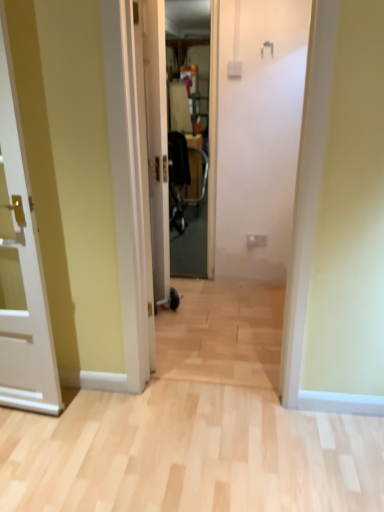
Question: Considering the relative sizes of transparent plastic screen door at center and white glossy door at left, the first door from the front, in the image provided, is transparent plastic screen door at center smaller than white glossy door at left, the first door from the front,?

Choices:
 (A) no
 (B) yes

Answer: (B)

Question: Is transparent plastic screen door at center facing away from white glossy door at left, which is the second door in right-to-left order?

Choices:
 (A) no
 (B) yes

Answer: (A)

Question: Is transparent plastic screen door at center bigger than white glossy door at left, the 1th door from the left?

Choices:
 (A) no
 (B) yes

Answer: (A)

Question: Is the depth of transparent plastic screen door at center less than that of white glossy door at left, which is the 2th door from back to front?

Choices:
 (A) yes
 (B) no

Answer: (B)

Question: Can you confirm if transparent plastic screen door at center is positioned to the left of white glossy door at left, the first door from the front?

Choices:
 (A) no
 (B) yes

Answer: (A)

Question: Is white glossy door at center, marked as the 1th door in a right-to-left arrangement, inside the boundaries of white glossy door at left, which is the 2th door from back to front, or outside?

Choices:
 (A) inside
 (B) outside

Answer: (B)

Question: From the image's perspective, is white glossy door at center, the 2th door when ordered from left to right, positioned above or below white glossy door at left, the first door from the front?

Choices:
 (A) above
 (B) below

Answer: (A)

Question: Based on their positions, is white glossy door at center, which is the second door from front to back, located to the left or right of white glossy door at left, which is the 2th door from back to front?

Choices:
 (A) right
 (B) left

Answer: (A)

Question: Considering the positions of white glossy door at center, the 2th door when ordered from left to right, and white glossy door at left, which is the second door in right-to-left order, in the image, is white glossy door at center, the 2th door when ordered from left to right, wider or thinner than white glossy door at left, which is the second door in right-to-left order,?

Choices:
 (A) wide
 (B) thin

Answer: (B)

Question: Is transparent plastic screen door at center wider or thinner than white glossy door at left, which is the 2th door from back to front?

Choices:
 (A) wide
 (B) thin

Answer: (A)

Question: In the image, is transparent plastic screen door at center positioned in front of or behind white glossy door at left, the 1th door from the left?

Choices:
 (A) front
 (B) behind

Answer: (B)

Question: Based on their sizes in the image, would you say transparent plastic screen door at center is bigger or smaller than white glossy door at left, the first door from the front?

Choices:
 (A) small
 (B) big

Answer: (A)

Question: From the image's perspective, is transparent plastic screen door at center located above or below white glossy door at left, which is the second door in right-to-left order?

Choices:
 (A) above
 (B) below

Answer: (A)

Question: Is transparent plastic screen door at center bigger or smaller than white glossy door at center, which is the 1th door from back to front?

Choices:
 (A) small
 (B) big

Answer: (A)

Question: From the image's perspective, is transparent plastic screen door at center located above or below white glossy door at center, the 2th door when ordered from left to right?

Choices:
 (A) above
 (B) below

Answer: (A)